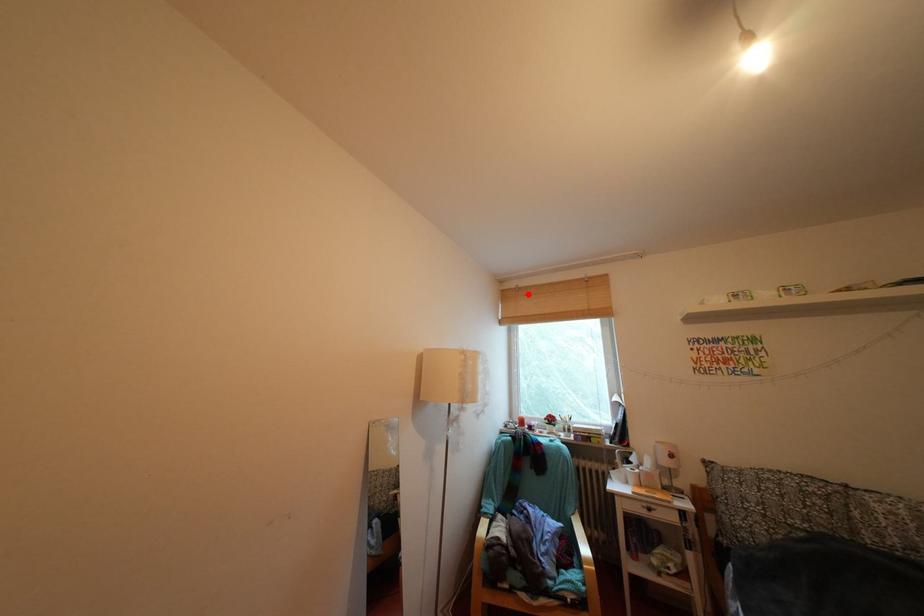
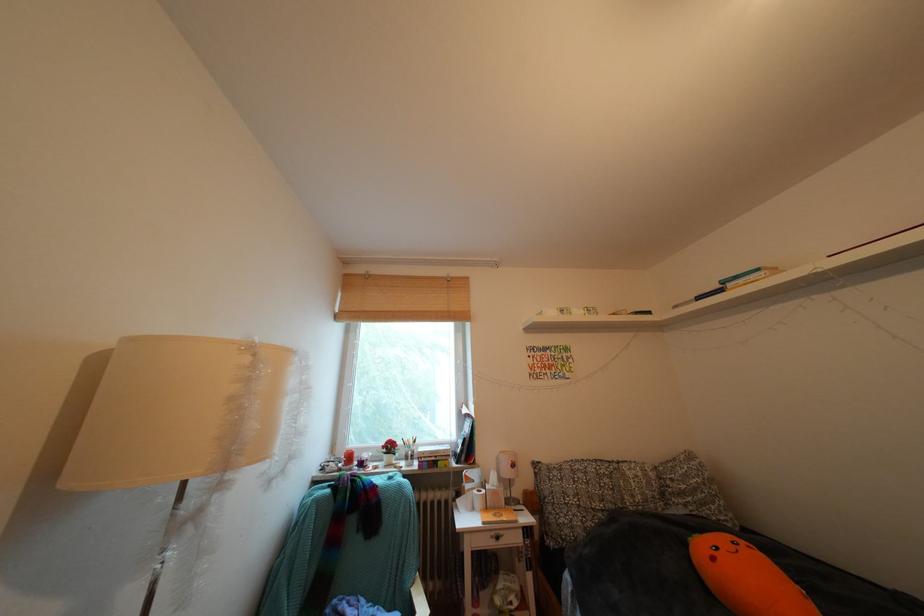
Locate, in the second image, the point that corresponds to the highlighted location in the first image.

(379, 282)